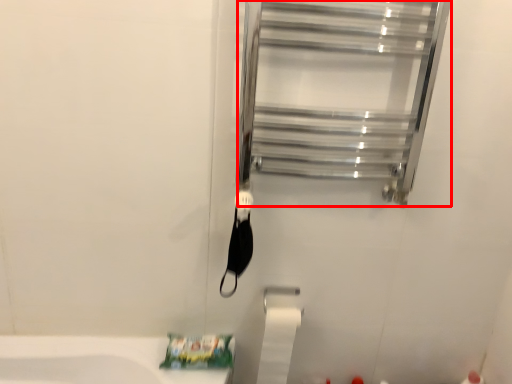
Question: Observing the image, what is the correct spatial positioning of glass door (annotated by the red box) in reference to toilet paper?

Choices:
 (A) right
 (B) left

Answer: (A)